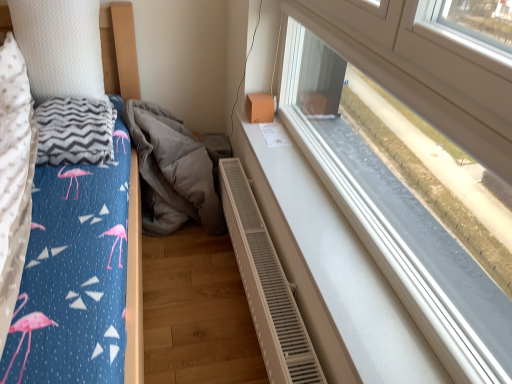
Where is `free spot in front of gray fabric at lower center`? free spot in front of gray fabric at lower center is located at coordinates (188, 269).